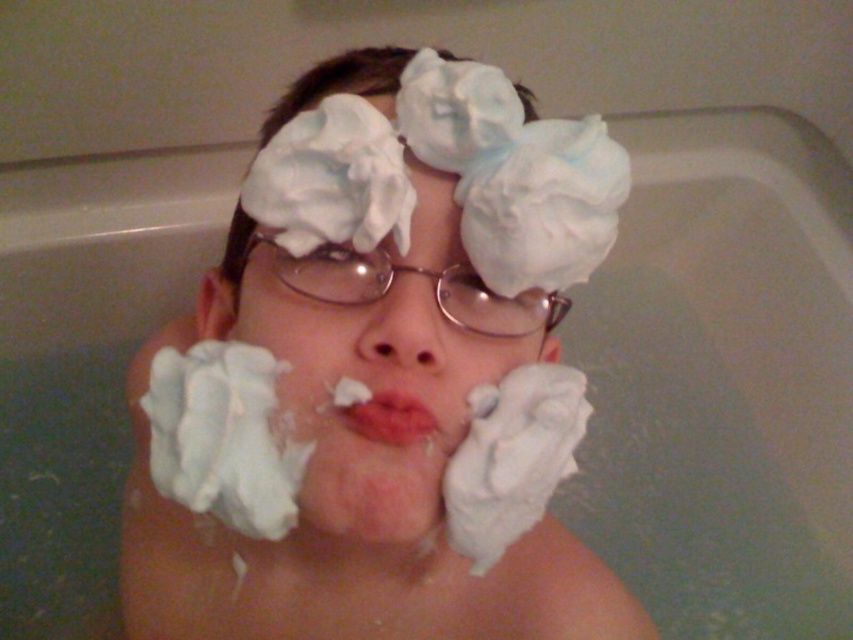
You are a baker who needs to distinguish between the white fluffy frosting at lower left and the white fluffy shaving cream at lower center. Based on their positions, which one should you use for decorating a cake?

The white fluffy frosting at lower left is closer to the viewer than the white fluffy shaving cream at lower center, so you should use the white fluffy frosting at lower left for decorating a cake because it is the appropriate material for baking.

You are a bathroom assistant and need to locate the white foamy shaving cream at center. According to the image, where exactly is it positioned?

The white foamy shaving cream at center is located at point (352, 509).

You are a caregiver assisting someone who has accidentally inhaled shaving cream foam. You see the white fluffy tissue at center and the white fluffy shaving cream at lower center. Which item should you use to help clear their airway?

You should use the white fluffy tissue at center to clear the airway because it is positioned over the white fluffy shaving cream at lower center, making it more accessible to reach the affected area.